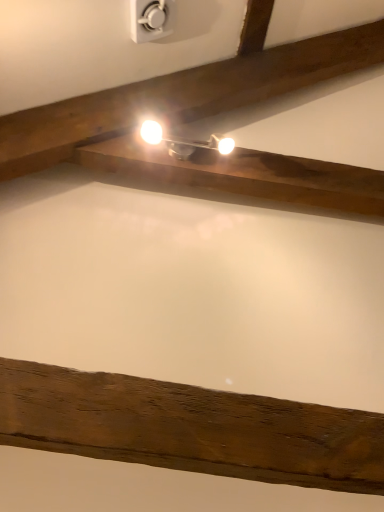
Question: Can you confirm if white glossy light fixture at upper center is positioned to the right of white plastic power plugs and sockets at upper center?

Choices:
 (A) yes
 (B) no

Answer: (A)

Question: Could you tell me if white glossy light fixture at upper center is turned towards white plastic power plugs and sockets at upper center?

Choices:
 (A) no
 (B) yes

Answer: (A)

Question: From a real-world perspective, is white glossy light fixture at upper center on white plastic power plugs and sockets at upper center?

Choices:
 (A) yes
 (B) no

Answer: (B)

Question: Is white glossy light fixture at upper center oriented away from white plastic power plugs and sockets at upper center?

Choices:
 (A) no
 (B) yes

Answer: (A)

Question: Does white glossy light fixture at upper center come in front of white plastic power plugs and sockets at upper center?

Choices:
 (A) no
 (B) yes

Answer: (A)

Question: From a real-world perspective, is white glossy light fixture at upper center beneath white plastic power plugs and sockets at upper center?

Choices:
 (A) yes
 (B) no

Answer: (A)

Question: Is white plastic power plugs and sockets at upper center far away from white glossy light fixture at upper center?

Choices:
 (A) no
 (B) yes

Answer: (A)

Question: From the image's perspective, is white plastic power plugs and sockets at upper center located above white glossy light fixture at upper center?

Choices:
 (A) no
 (B) yes

Answer: (B)

Question: Is white plastic power plugs and sockets at upper center wider than white glossy light fixture at upper center?

Choices:
 (A) yes
 (B) no

Answer: (B)

Question: Does white plastic power plugs and sockets at upper center lie in front of white glossy light fixture at upper center?

Choices:
 (A) no
 (B) yes

Answer: (B)

Question: Is white glossy light fixture at upper center at the back of white plastic power plugs and sockets at upper center?

Choices:
 (A) no
 (B) yes

Answer: (A)

Question: Could you tell me if white plastic power plugs and sockets at upper center is turned towards white glossy light fixture at upper center?

Choices:
 (A) no
 (B) yes

Answer: (A)

Question: From a real-world perspective, relative to white plastic power plugs and sockets at upper center, is white glossy light fixture at upper center vertically above or below?

Choices:
 (A) above
 (B) below

Answer: (B)